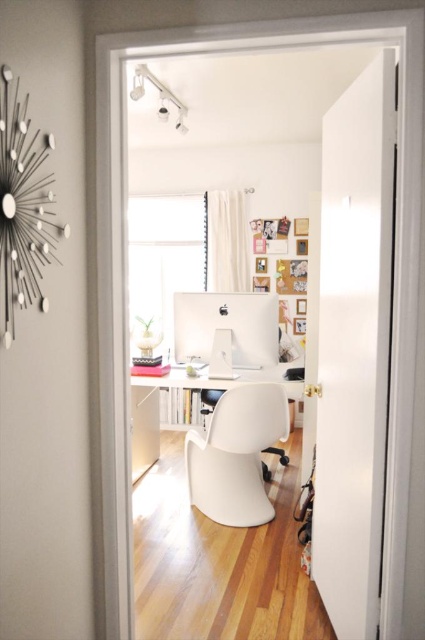
Between point (226, 412) and point (274, 371), which one is positioned in front?

Positioned in front is point (226, 412).

Who is higher up, white plastic swivel chair at center or white plastic desk at center?

Positioned higher is white plastic desk at center.

What do you see at coordinates (235, 454) in the screenshot? I see `white plastic swivel chair at center` at bounding box center [235, 454].

Identify the location of white plastic swivel chair at center. The height and width of the screenshot is (640, 425). (235, 454).

Can you confirm if white plastic swivel chair at center is bigger than white glossy computer at center?

Indeed, white plastic swivel chair at center has a larger size compared to white glossy computer at center.

Does white plastic swivel chair at center have a greater width compared to white glossy computer at center?

In fact, white plastic swivel chair at center might be narrower than white glossy computer at center.

Who is more forward, (261, 424) or (254, 301)?

Point (261, 424)

Locate an element on the screen. This screenshot has width=425, height=640. white plastic swivel chair at center is located at coordinates (235, 454).

The image size is (425, 640). What do you see at coordinates (226, 326) in the screenshot?
I see `white glossy computer at center` at bounding box center [226, 326].

Between point (201, 324) and point (189, 397), which one is positioned behind?

The point (189, 397) is more distant.

Describe the element at coordinates (226, 326) in the screenshot. The width and height of the screenshot is (425, 640). I see `white glossy computer at center` at that location.

Identify the location of white glossy computer at center. This screenshot has height=640, width=425. (226, 326).